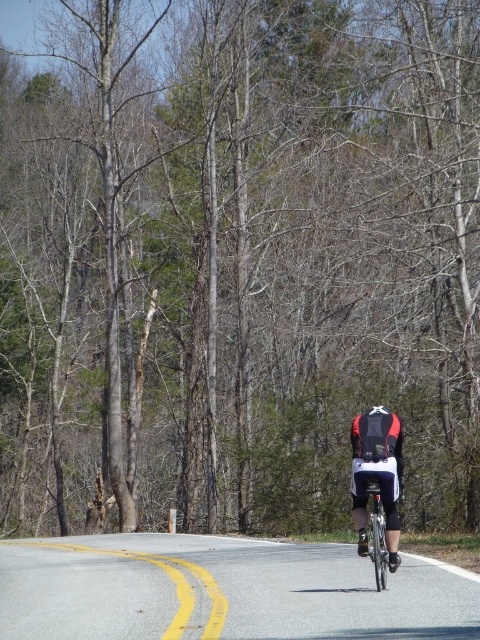
Consider the image. Which is below, red and black cycling jersey at center or matte black helmet at center?

Positioned lower is red and black cycling jersey at center.

Is red and black cycling jersey at center below matte black helmet at center?

Correct, red and black cycling jersey at center is located below matte black helmet at center.

Find the location of a particular element. red and black cycling jersey at center is located at coordinates (376, 476).